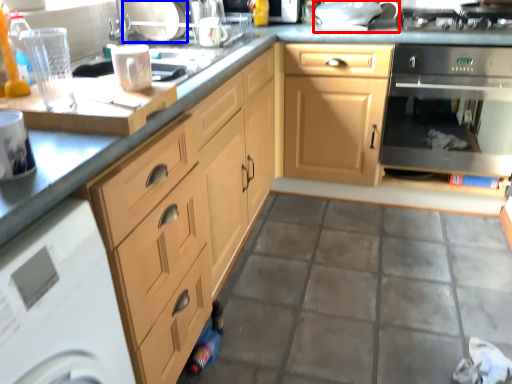
Question: Among these objects, which one is nearest to the camera, appliance (highlighted by a red box) or appliance (highlighted by a blue box)?

Choices:
 (A) appliance
 (B) appliance

Answer: (B)